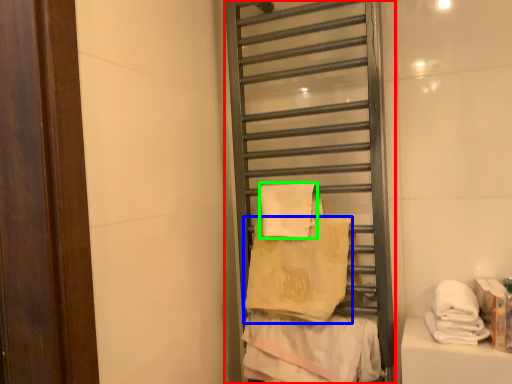
Question: Considering the real-world distances, which object is farthest from shelf (highlighted by a red box)? towel (highlighted by a blue box) or towel (highlighted by a green box)?

Choices:
 (A) towel
 (B) towel

Answer: (B)